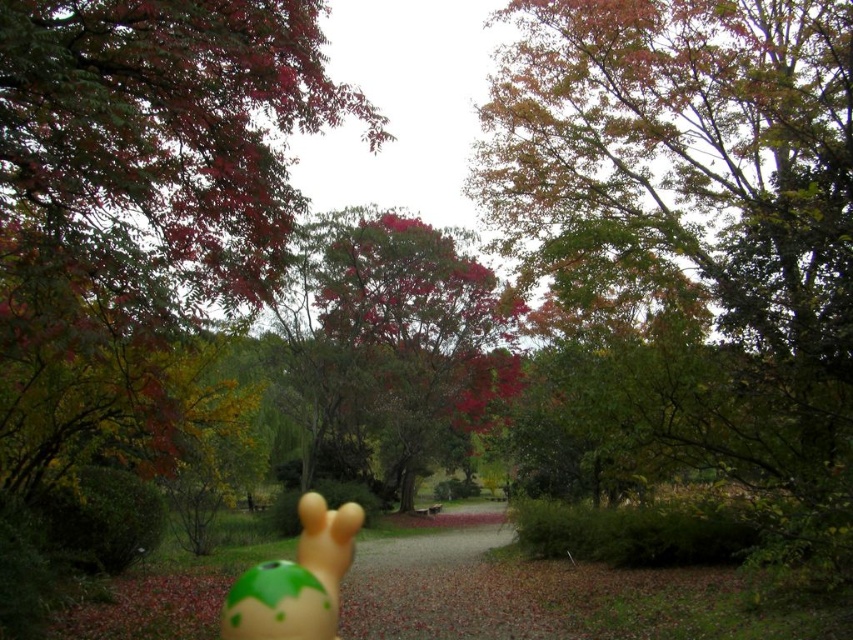
Can you confirm if green leafy tree at upper center is positioned below smooth red leaves at upper left?

Incorrect, green leafy tree at upper center is not positioned below smooth red leaves at upper left.

Does green leafy tree at upper center have a greater width compared to smooth red leaves at upper left?

Correct, the width of green leafy tree at upper center exceeds that of smooth red leaves at upper left.

The height and width of the screenshot is (640, 853). I want to click on green leafy tree at upper center, so click(698, 221).

You are a GUI agent. You are given a task and a screenshot of the screen. Output one action in this format:
    pyautogui.click(x=<x>, y=<y>)
    Task: Click on the green leafy tree at upper center
    
    Given the screenshot: What is the action you would take?
    pyautogui.click(x=698, y=221)

Who is shorter, smooth red leaves at upper left or reddish-brown bark tree at center?

With less height is smooth red leaves at upper left.

Image resolution: width=853 pixels, height=640 pixels. In order to click on smooth red leaves at upper left in this screenshot , I will do `click(160, 136)`.

Is point (257, 35) in front of point (354, 304)?

Yes, it is.

You are a GUI agent. You are given a task and a screenshot of the screen. Output one action in this format:
    pyautogui.click(x=<x>, y=<y>)
    Task: Click on the smooth red leaves at upper left
    
    Given the screenshot: What is the action you would take?
    pyautogui.click(x=160, y=136)

Which is above, smooth red leaves at upper left or matte green rubber toy at center?

smooth red leaves at upper left

Is point (13, 84) positioned before point (271, 618)?

Yes, it is.

Who is more forward, (x=277, y=84) or (x=248, y=596)?

Positioned in front is point (x=248, y=596).

At what (x,y) coordinates should I click in order to perform the action: click on smooth red leaves at upper left. Please return your answer as a coordinate pair (x, y). Image resolution: width=853 pixels, height=640 pixels. Looking at the image, I should click on (160, 136).